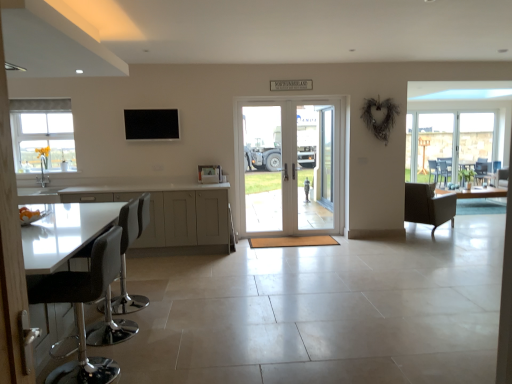
Where is `vacant area that is situated to the right of black leather bar stool at left, which is the first chair in left-to-right order`? Image resolution: width=512 pixels, height=384 pixels. vacant area that is situated to the right of black leather bar stool at left, which is the first chair in left-to-right order is located at coordinates (165, 332).